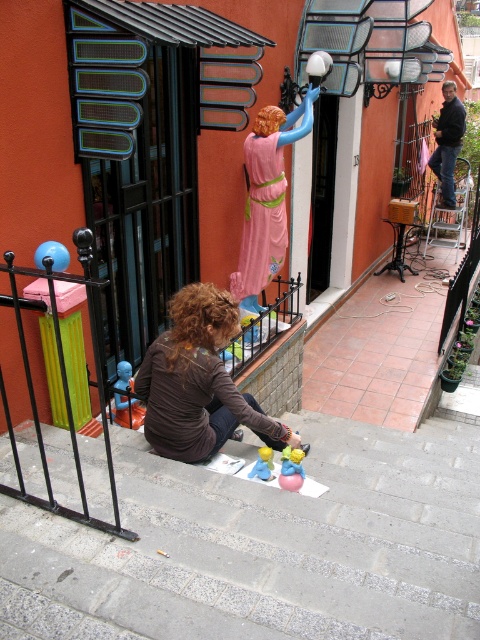
Between point (279, 474) and point (120, 385), which one is positioned behind?

Point (120, 385)

Can you confirm if smooth plastic toy at center is smaller than blue plastic toy at lower left?

Yes, smooth plastic toy at center is smaller than blue plastic toy at lower left.

Which is in front, point (300, 474) or point (134, 397)?

Point (300, 474) is in front.

The image size is (480, 640). What are the coordinates of `smooth plastic toy at center` in the screenshot? It's located at (291, 468).

The height and width of the screenshot is (640, 480). Describe the element at coordinates (447, 141) in the screenshot. I see `dark blue jeans at center` at that location.

Which is more to the left, dark blue jeans at center or matte plastic toy at center?

Positioned to the left is matte plastic toy at center.

This screenshot has width=480, height=640. What do you see at coordinates (447, 141) in the screenshot? I see `dark blue jeans at center` at bounding box center [447, 141].

I want to click on dark blue jeans at center, so click(x=447, y=141).

Which is more to the left, brown fabric at center or dark blue jeans at center?

brown fabric at center

Who is more distant from viewer, (x=189, y=384) or (x=444, y=132)?

Positioned behind is point (x=444, y=132).

Which is behind, point (228, 296) or point (455, 163)?

Positioned behind is point (455, 163).

At what (x,y) coordinates should I click in order to perform the action: click on brown fabric at center. Please return your answer as a coordinate pair (x, y). This screenshot has height=640, width=480. Looking at the image, I should click on (199, 381).